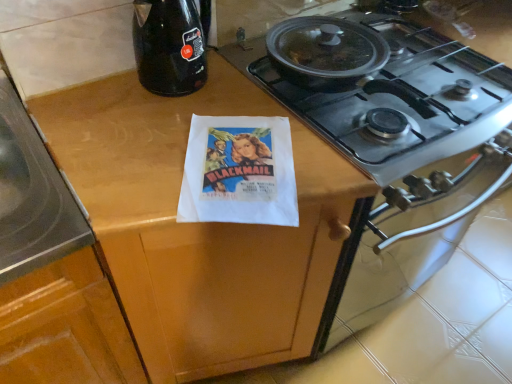
Question: Is point (140, 122) closer or farther from the camera than point (186, 4)?

Choices:
 (A) farther
 (B) closer

Answer: (A)

Question: In terms of size, does wooden at center appear bigger or smaller than black glass bottle at upper left?

Choices:
 (A) big
 (B) small

Answer: (A)

Question: Considering the real-world distances, which object is closest to the black glass bottle at upper left?

Choices:
 (A) wooden at center
 (B) stainless steel gas stove at upper right
 (C) white paper flyer at center

Answer: (C)

Question: Which object is the closest to the wooden at center?

Choices:
 (A) black glass bottle at upper left
 (B) white paper flyer at center
 (C) stainless steel gas stove at upper right

Answer: (B)